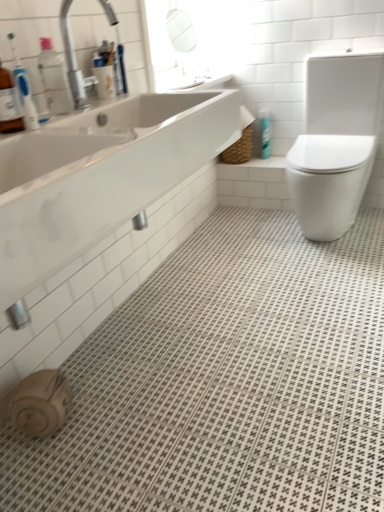
Question: Does white glossy sink at upper left turn towards silver metallic faucet at upper left?

Choices:
 (A) no
 (B) yes

Answer: (A)

Question: Is white glossy sink at upper left to the right of silver metallic faucet at upper left from the viewer's perspective?

Choices:
 (A) yes
 (B) no

Answer: (A)

Question: Is white glossy sink at upper left behind silver metallic faucet at upper left?

Choices:
 (A) yes
 (B) no

Answer: (B)

Question: From the image's perspective, is white glossy sink at upper left on silver metallic faucet at upper left?

Choices:
 (A) no
 (B) yes

Answer: (A)

Question: Considering the relative sizes of white glossy sink at upper left and silver metallic faucet at upper left in the image provided, is white glossy sink at upper left taller than silver metallic faucet at upper left?

Choices:
 (A) no
 (B) yes

Answer: (B)

Question: Is white glossy sink at upper left thinner than silver metallic faucet at upper left?

Choices:
 (A) no
 (B) yes

Answer: (A)

Question: Does blue glossy spray can at upper right have a greater width compared to white glossy sink at upper left?

Choices:
 (A) yes
 (B) no

Answer: (B)

Question: From the image's perspective, is blue glossy spray can at upper right below white glossy sink at upper left?

Choices:
 (A) yes
 (B) no

Answer: (B)

Question: Can you confirm if blue glossy spray can at upper right is bigger than white glossy sink at upper left?

Choices:
 (A) no
 (B) yes

Answer: (A)

Question: From the image's perspective, is blue glossy spray can at upper right over white glossy sink at upper left?

Choices:
 (A) no
 (B) yes

Answer: (B)

Question: Is the depth of blue glossy spray can at upper right less than that of white glossy sink at upper left?

Choices:
 (A) no
 (B) yes

Answer: (A)

Question: Is blue glossy spray can at upper right facing towards white glossy sink at upper left?

Choices:
 (A) no
 (B) yes

Answer: (B)

Question: Can you confirm if silver metallic faucet at upper left is thinner than blue glossy spray can at upper right?

Choices:
 (A) yes
 (B) no

Answer: (B)